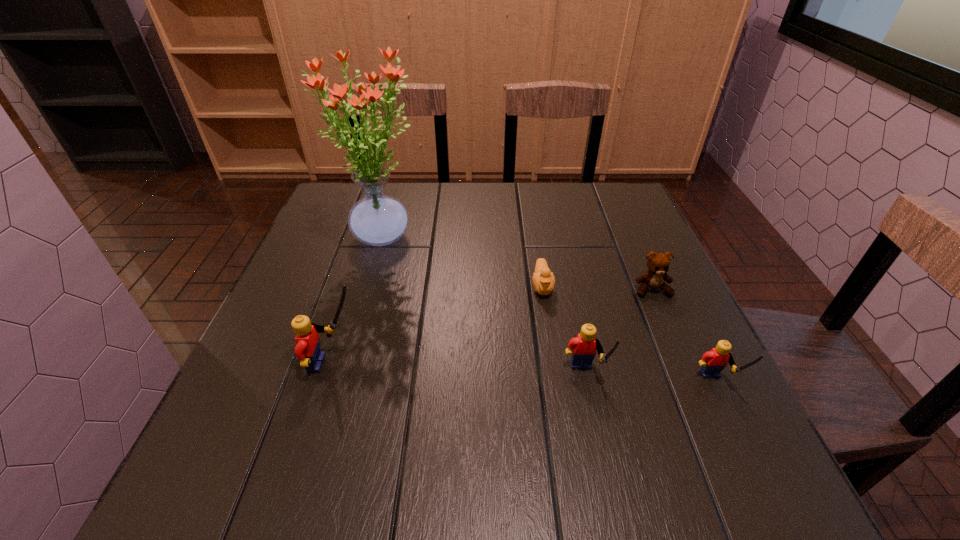
The image size is (960, 540). I want to click on vacant area located 0.050m on the front-facing side of the rightmost Lego, so click(x=735, y=428).

What are the coordinates of `free spot located 0.070m on the face of the duckling` in the screenshot? It's located at (548, 325).

The width and height of the screenshot is (960, 540). I want to click on vacant area located on the right of the tallest object, so click(472, 236).

I want to click on vacant area located on the front-facing side of the teddy bear, so click(687, 372).

The height and width of the screenshot is (540, 960). I want to click on object located at the far edge, so click(377, 219).

Image resolution: width=960 pixels, height=540 pixels. I want to click on Lego positioned at the left edge, so click(307, 340).

Image resolution: width=960 pixels, height=540 pixels. Identify the location of flower arrangement at the left edge. (377, 219).

Locate an element on the screen. This screenshot has width=960, height=540. Lego situated at the right edge is located at coordinates (713, 362).

I want to click on teddy bear that is at the right edge, so click(x=658, y=264).

You are a GUI agent. You are given a task and a screenshot of the screen. Output one action in this format:
    pyautogui.click(x=<x>, y=<y>)
    Task: Click on the object present at the far left corner
    
    Given the screenshot: What is the action you would take?
    pyautogui.click(x=377, y=219)